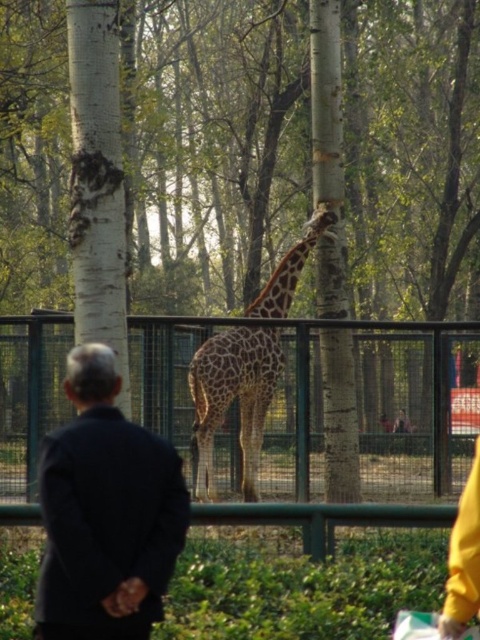
You are a zoo visitor trying to take a photo of the spotted fur giraffe at center. However, the green metal fence at center is blocking your view. Can you move to the left or right to get a clear shot without the fence in the way?

The green metal fence at center is positioned over the spotted fur giraffe at center, so moving to the left or right might help avoid the fence and get a clear view of the giraffe.

You are standing at the entrance of the zoo enclosure and want to take a photo of the giraffe without including the green metal fence at center in the frame. Based on your current position, can you position yourself in a way to exclude the fence from your shot?

The green metal fence at center is located at point (375, 406), so if you position yourself away from that coordinate, you can exclude it from your photo.

You are a zookeeper observing the scene. You notice the dark blue suit at center and the spotted fur giraffe at center. Which object is positioned closer to you?

The dark blue suit at center is closer to the viewer than the spotted fur giraffe at center.